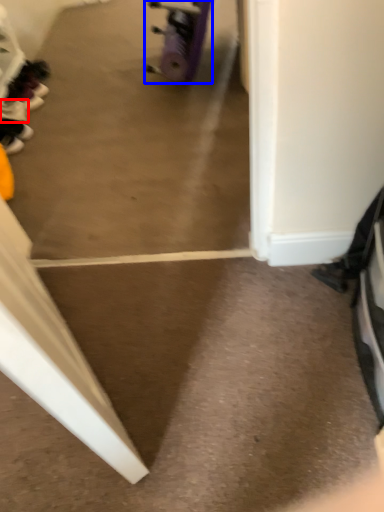
Question: Which of the following is the closest to the observer, footwear (highlighted by a red box) or wheel (highlighted by a blue box)?

Choices:
 (A) footwear
 (B) wheel

Answer: (B)